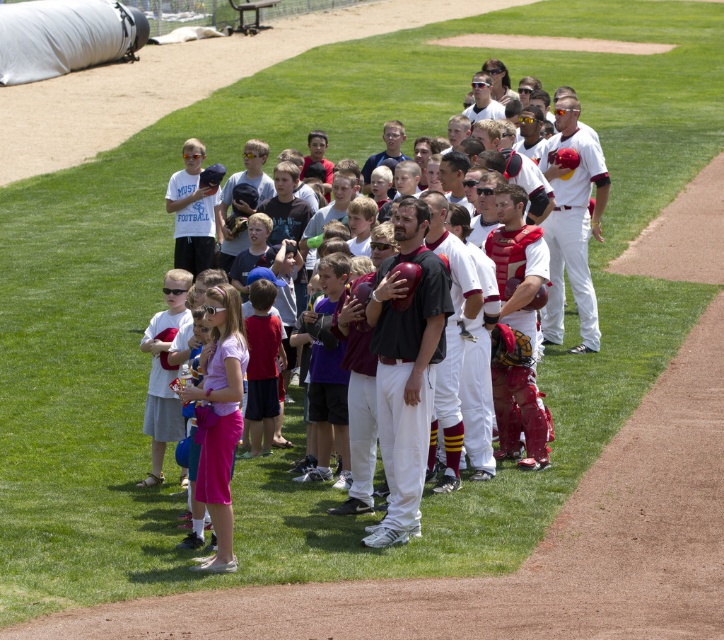
Question: Is white matte baseball uniform at center to the left of white uniform baseball team at center from the viewer's perspective?

Choices:
 (A) yes
 (B) no

Answer: (B)

Question: Which of the following is the closest to the observer?

Choices:
 (A) (211, 464)
 (B) (384, 410)
 (C) (251, 547)
 (D) (505, 236)

Answer: (A)

Question: Which point is farther to the camera?

Choices:
 (A) pink fabric dress at center
 (B) maroon leather catcher's gear at center
 (C) brown leather glove at center
 (D) black matte baseball uniform at center

Answer: (C)

Question: Is pink fabric dress at center to the right of white uniform baseball team at center from the viewer's perspective?

Choices:
 (A) yes
 (B) no

Answer: (B)

Question: Can you confirm if black matte baseball uniform at center is positioned above white matte baseball uniform at center?

Choices:
 (A) yes
 (B) no

Answer: (B)

Question: Among these points, which one is farthest from the camera?

Choices:
 (A) (437, 268)
 (B) (235, 557)

Answer: (A)